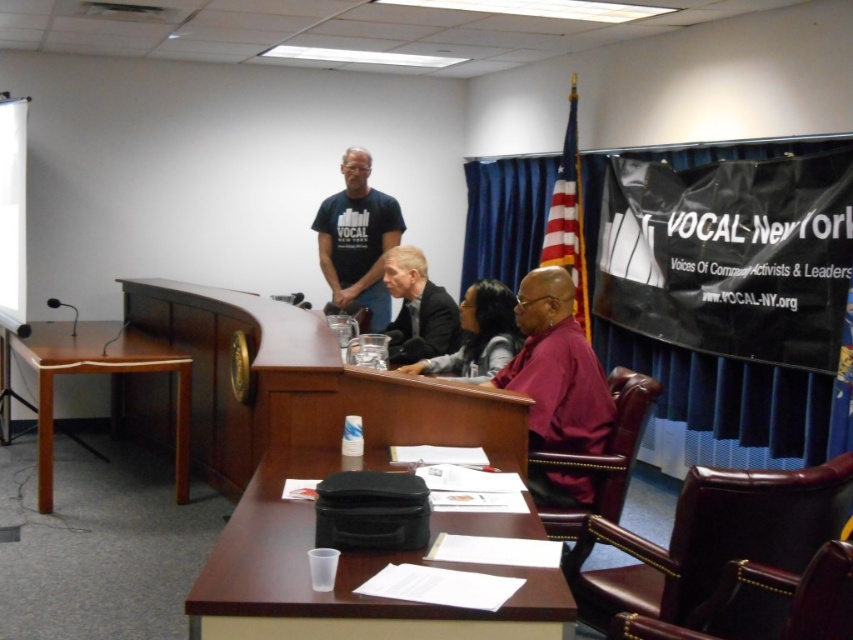
Question: Does purple matte shirt at center appear over black t-shirt at center?

Choices:
 (A) yes
 (B) no

Answer: (B)

Question: Which object appears farthest from the camera in this image?

Choices:
 (A) black t-shirt at center
 (B) white paper at left

Answer: (A)

Question: Does brown wood table at center have a smaller size compared to white paper at left?

Choices:
 (A) yes
 (B) no

Answer: (A)

Question: Which object is farther from the camera taking this photo?

Choices:
 (A) matte black jacket at center
 (B) white paper at left
 (C) purple matte shirt at center
 (D) brown wood table at center

Answer: (B)

Question: Is purple matte shirt at center thinner than matte black jacket at center?

Choices:
 (A) yes
 (B) no

Answer: (A)

Question: Which of the following is the closest to the observer?

Choices:
 (A) dark suit at center
 (B) white paper at left
 (C) brown wood table at center

Answer: (C)